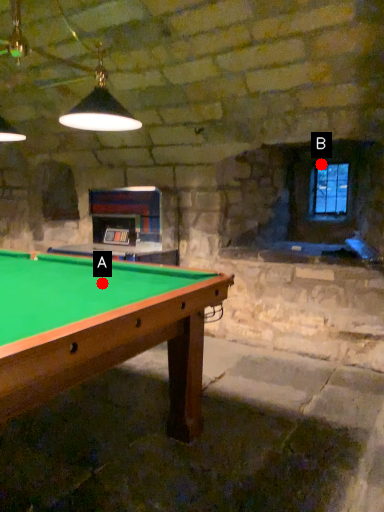
Question: Two points are circled on the image, labeled by A and B beside each circle. Which point is closer to the camera taking this photo?

Choices:
 (A) A is closer
 (B) B is closer

Answer: (A)